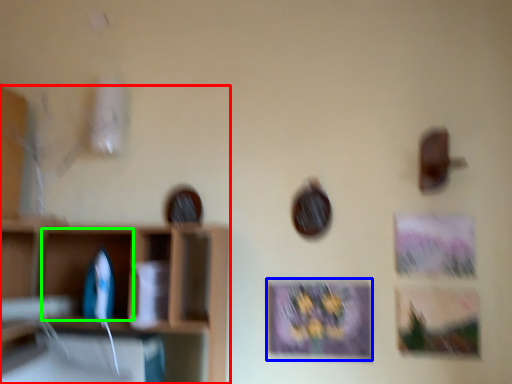
Question: Which object is positioned closest to shelf (highlighted by a red box)? Select from picture frame (highlighted by a blue box) and cabinet (highlighted by a green box).

Choices:
 (A) picture frame
 (B) cabinet

Answer: (B)